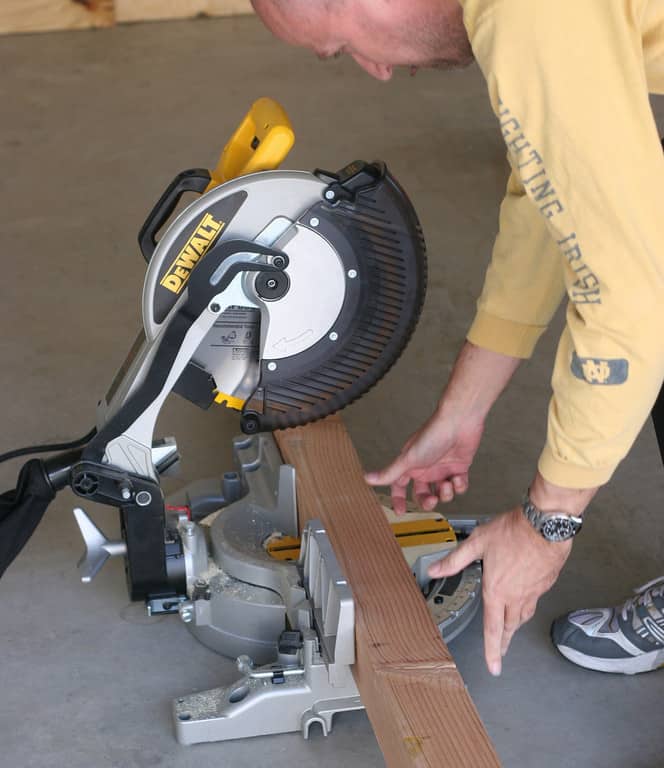
In order to click on board in this screenshot , I will do `click(46, 12)`.